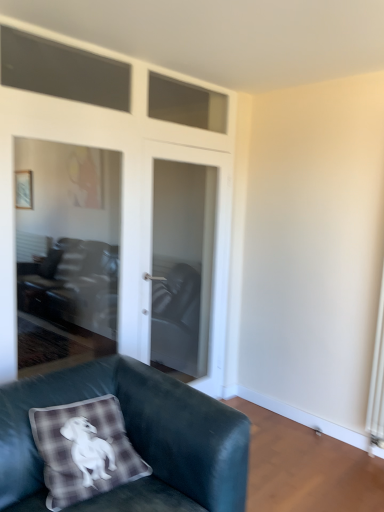
Question: Is white glossy door at center bigger or smaller than velvet dark green couch at lower left?

Choices:
 (A) small
 (B) big

Answer: (A)

Question: Considering their positions, is white glossy door at center located in front of or behind velvet dark green couch at lower left?

Choices:
 (A) front
 (B) behind

Answer: (B)

Question: Considering the positions of white glossy door at center and velvet dark green couch at lower left in the image, is white glossy door at center wider or thinner than velvet dark green couch at lower left?

Choices:
 (A) thin
 (B) wide

Answer: (A)

Question: In the image, is velvet dark green couch at lower left on the left side or the right side of white glossy door at center?

Choices:
 (A) right
 (B) left

Answer: (B)

Question: In terms of size, does velvet dark green couch at lower left appear bigger or smaller than white glossy door at center?

Choices:
 (A) big
 (B) small

Answer: (A)

Question: Looking at their shapes, would you say velvet dark green couch at lower left is wider or thinner than white glossy door at center?

Choices:
 (A) wide
 (B) thin

Answer: (A)

Question: Is velvet dark green couch at lower left inside or outside of white glossy door at center?

Choices:
 (A) inside
 (B) outside

Answer: (B)